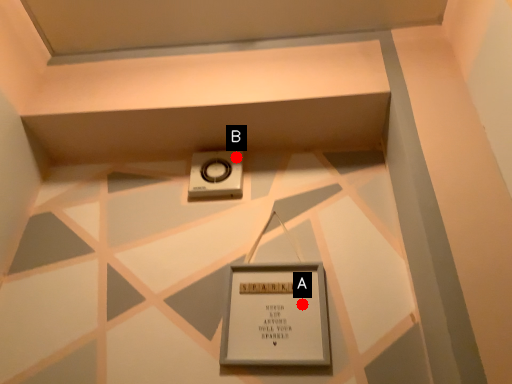
Question: Two points are circled on the image, labeled by A and B beside each circle. Which point is further to the camera?

Choices:
 (A) A is further
 (B) B is further

Answer: (B)